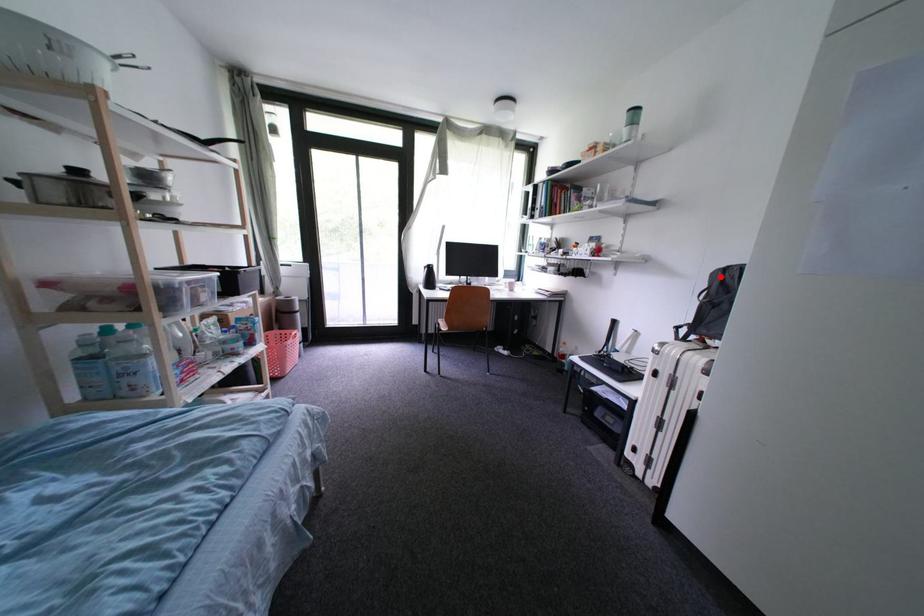
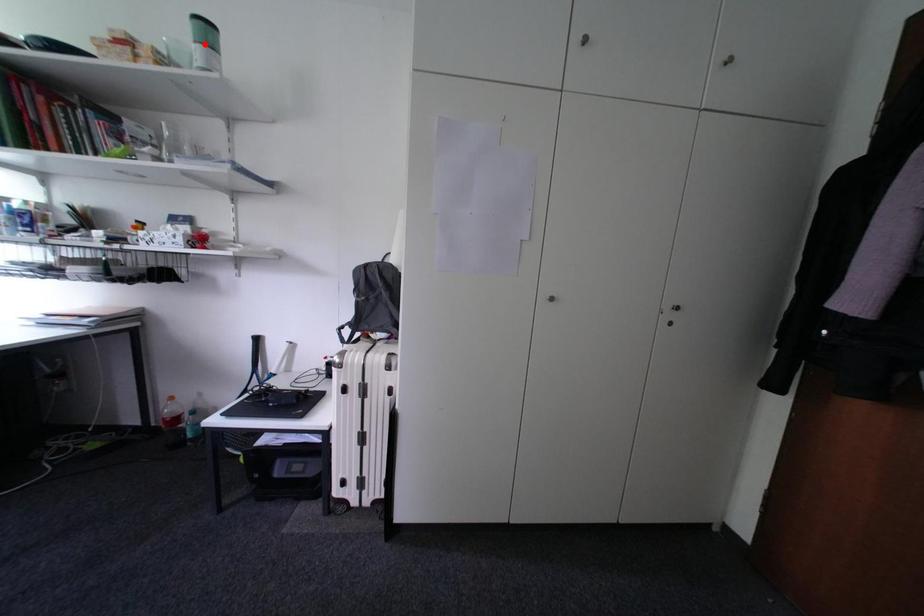
I am providing you with two images of the same scene from different viewpoints. A red point is marked on the first image and another point is marked on the second image. Is the marked point in image1 the same physical position as the marked point in image2?

No